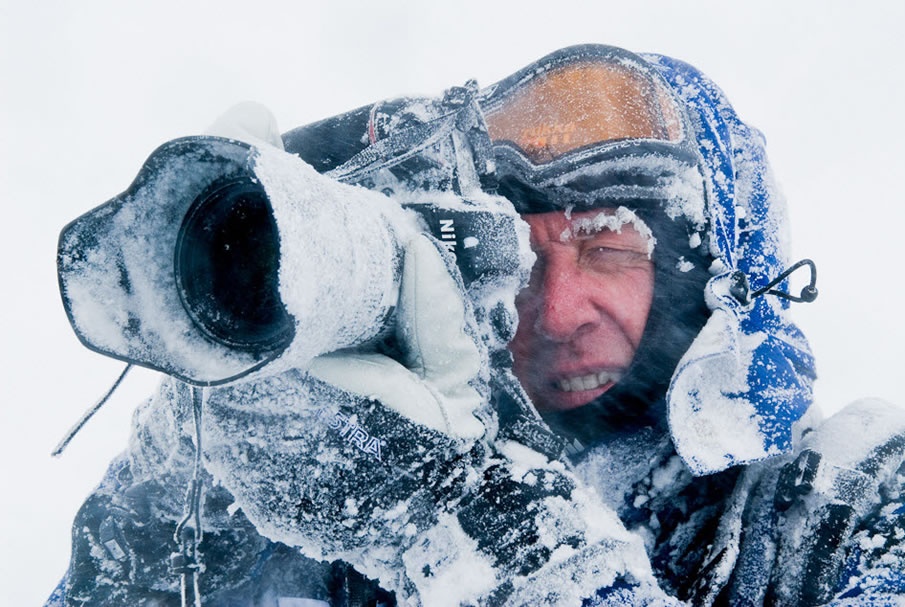
Where is `cord knob`? The width and height of the screenshot is (905, 607). cord knob is located at coordinates (801, 296).